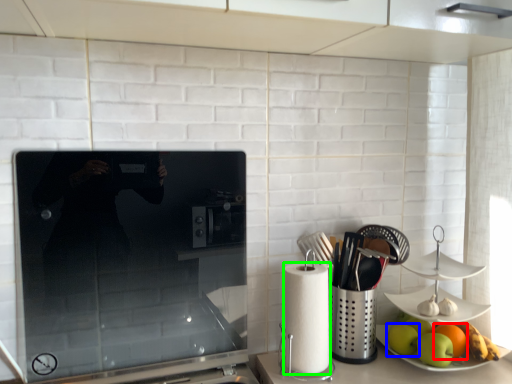
Question: Based on their relative distances, which object is farther from orange (highlighted by a red box)? Choose from apple (highlighted by a blue box) and paper towel (highlighted by a green box).

Choices:
 (A) apple
 (B) paper towel

Answer: (B)